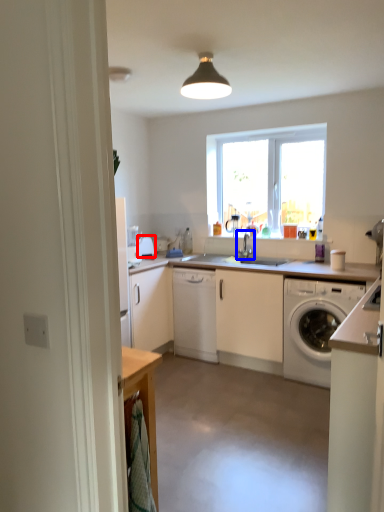
Question: Among these objects, which one is farthest to the camera, appliance (highlighted by a red box) or tap (highlighted by a blue box)?

Choices:
 (A) appliance
 (B) tap

Answer: (A)